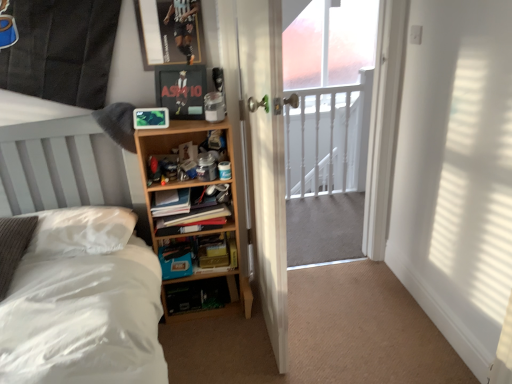
The width and height of the screenshot is (512, 384). Find the location of `vacant space in front of matte black picture frame at upper center, which is counted as the first picture frame, starting from the bottom`. vacant space in front of matte black picture frame at upper center, which is counted as the first picture frame, starting from the bottom is located at coordinates (183, 121).